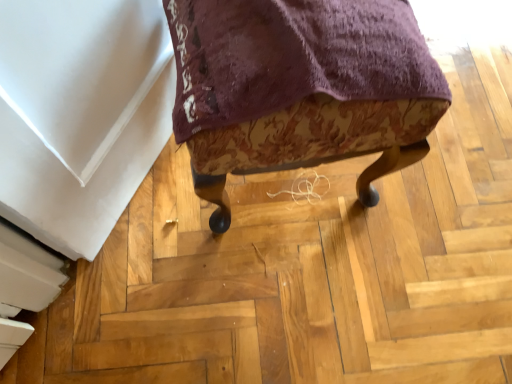
Identify the location of free location in front of velvet floral ottoman at center. This screenshot has height=384, width=512. (289, 297).